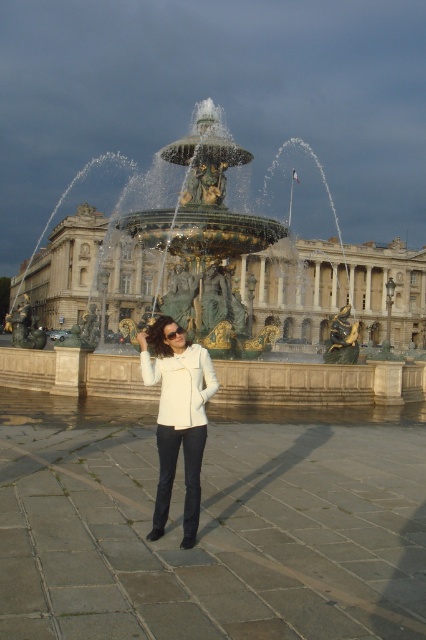
At what (x,y) coordinates should I click in order to perform the action: click on bronze/golden water at center. Please return your answer as a coordinate pair (x, y). Looking at the image, I should click on (219, 296).

Does point (253, 307) come in front of point (408, 280)?

Yes, it is.

Describe the element at coordinates (219, 296) in the screenshot. I see `bronze/golden water at center` at that location.

This screenshot has width=426, height=640. Find the location of `bronze/golden water at center`. bronze/golden water at center is located at coordinates (219, 296).

Looking at this image, which of these two, gold/gilded stone fountain at center or white matte jacket at center, stands shorter?

white matte jacket at center

Can you confirm if gold/gilded stone fountain at center is shorter than white matte jacket at center?

No, gold/gilded stone fountain at center is not shorter than white matte jacket at center.

Identify the location of gold/gilded stone fountain at center. This screenshot has width=426, height=640. (333, 288).

Is bronze/golden water at center positioned in front of white matte jacket at center?

No, it is not.

How much distance is there between bronze/golden water at center and white matte jacket at center?

The distance of bronze/golden water at center from white matte jacket at center is 113.22 meters.

Is point (207, 300) positioned behind point (213, 376)?

Yes, point (207, 300) is farther from viewer.

The width and height of the screenshot is (426, 640). What are the coordinates of `bronze/golden water at center` in the screenshot? It's located at (219, 296).